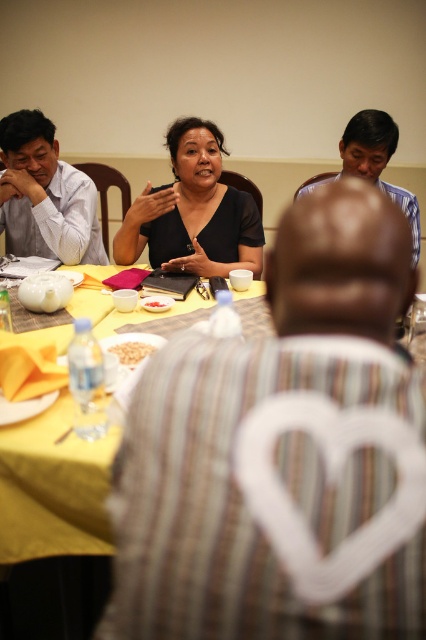
Who is lower down, yellow fabric table at center or blue striped shirt at upper right?

yellow fabric table at center is below.

Does point (71, 547) lie in front of point (340, 156)?

Yes, it is in front of point (340, 156).

At what (x,y) coordinates should I click in order to perform the action: click on yellow fabric table at center. Please return your answer as a coordinate pair (x, y). Looking at the image, I should click on (52, 486).

Does matte white shirt at left appear over blue striped shirt at upper right?

Yes.

Does matte white shirt at left have a larger size compared to blue striped shirt at upper right?

No.

In order to click on matte white shirt at left in this screenshot , I will do `click(45, 195)`.

Which is below, black matte dress at center or white crumbly food at center?

white crumbly food at center is lower down.

Based on the photo, who is more distant from viewer, (x=141, y=202) or (x=152, y=352)?

The point (x=141, y=202) is behind.

This screenshot has width=426, height=640. What do you see at coordinates (192, 212) in the screenshot? I see `black matte dress at center` at bounding box center [192, 212].

In order to click on black matte dress at center in this screenshot , I will do `click(192, 212)`.